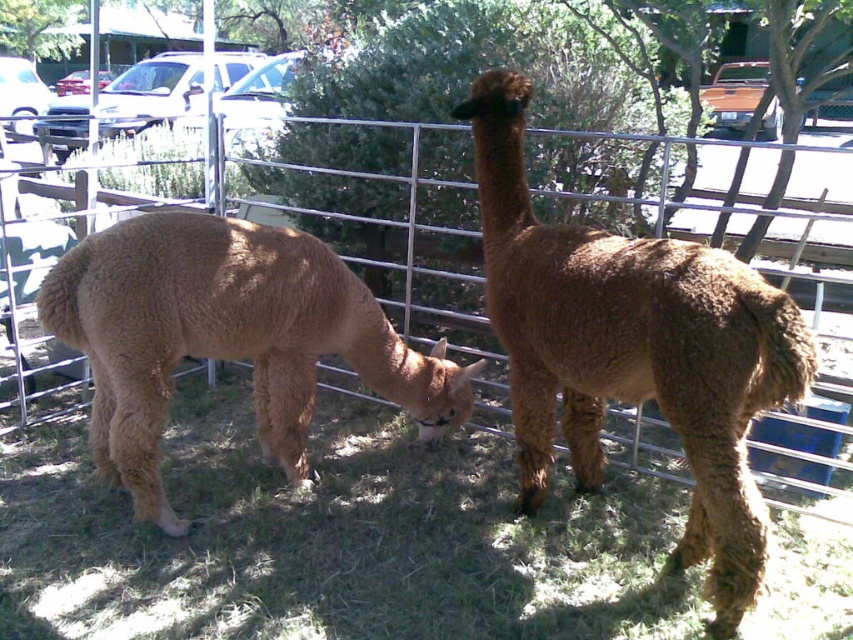
Does green soft grass at center appear on the left side of brown woolly alpaca at center?

Yes, green soft grass at center is to the left of brown woolly alpaca at center.

Who is more forward, (345, 563) or (527, 83)?

Positioned in front is point (345, 563).

Find the location of a particular element. This screenshot has height=640, width=853. green soft grass at center is located at coordinates (332, 540).

Does green soft grass at center appear on the right side of brown woolen camel at center?

Indeed, green soft grass at center is positioned on the right side of brown woolen camel at center.

Based on the photo, measure the distance between point (790,602) and camera.

A distance of 2.26 meters exists between point (790,602) and camera.

Locate an element on the screen. green soft grass at center is located at coordinates (332, 540).

What do you see at coordinates (633, 349) in the screenshot?
I see `brown woolly alpaca at center` at bounding box center [633, 349].

The height and width of the screenshot is (640, 853). I want to click on brown woolly alpaca at center, so click(633, 349).